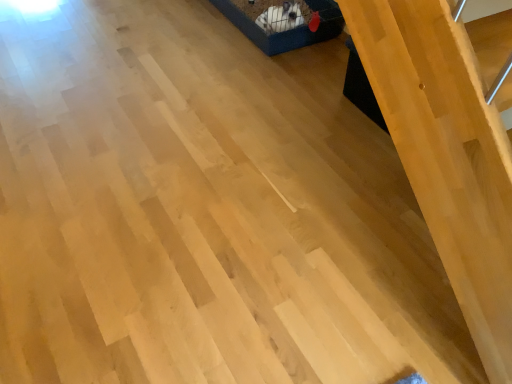
Locate an element on the screen. The image size is (512, 384). blue plastic cage at upper center is located at coordinates pyautogui.click(x=285, y=31).

This screenshot has height=384, width=512. What do you see at coordinates (285, 31) in the screenshot? I see `blue plastic cage at upper center` at bounding box center [285, 31].

Where is `blue plastic cage at upper center`? This screenshot has width=512, height=384. blue plastic cage at upper center is located at coordinates (285, 31).